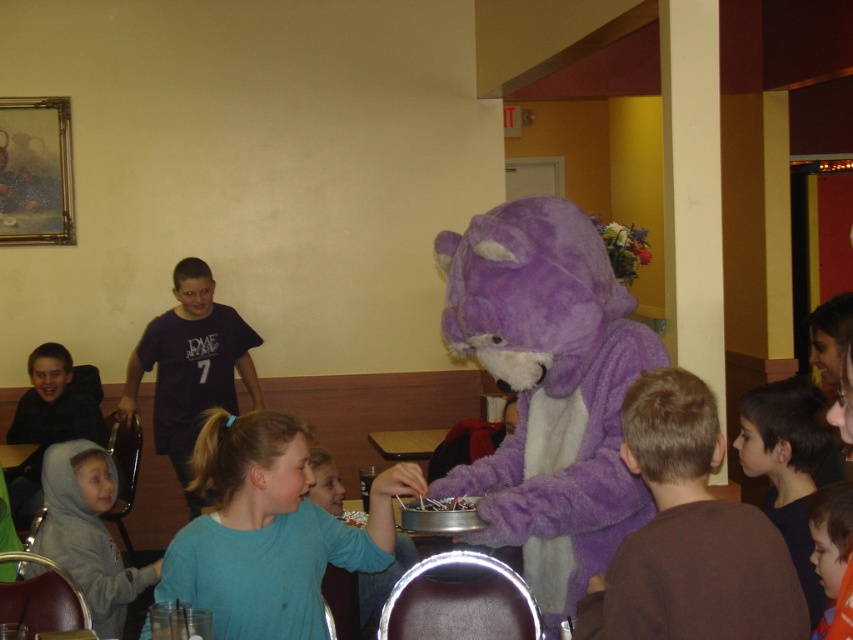
Question: Does purple plush teddy bear at center appear on the left side of blue fleece shirt at center?

Choices:
 (A) yes
 (B) no

Answer: (B)

Question: Is purple fuzzy costume at center thinner than light blue shirt at center?

Choices:
 (A) yes
 (B) no

Answer: (B)

Question: Which point is closer to the camera taking this photo?

Choices:
 (A) (100, 528)
 (B) (601, 605)
 (C) (119, 408)

Answer: (B)

Question: Does purple plush teddy bear at center have a greater width compared to purple fuzzy costume at center?

Choices:
 (A) yes
 (B) no

Answer: (B)

Question: Which point is closer to the camera?

Choices:
 (A) purple plush teddy bear at center
 (B) dark brown hair at lower right

Answer: (A)

Question: Among these objects, which one is farthest from the camera?

Choices:
 (A) purple fuzzy costume at center
 (B) gray fleece hoodie at lower left
 (C) blue fleece shirt at center

Answer: (A)